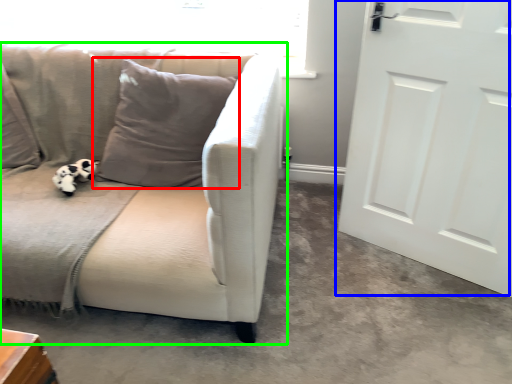
Question: Which object is the closest to the pillow (highlighted by a red box)? Choose among these: door (highlighted by a blue box) or studio couch (highlighted by a green box).

Choices:
 (A) door
 (B) studio couch

Answer: (B)